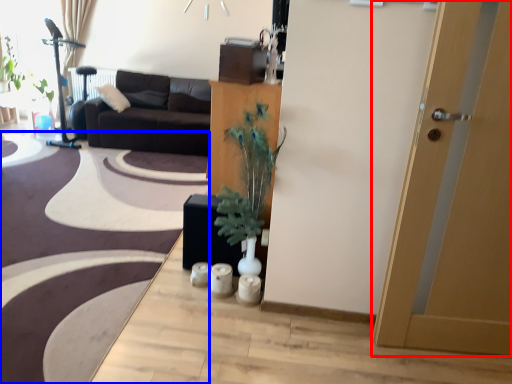
Question: Which of the following is the closest to the observer, door (highlighted by a red box) or plain (highlighted by a blue box)?

Choices:
 (A) door
 (B) plain

Answer: (A)